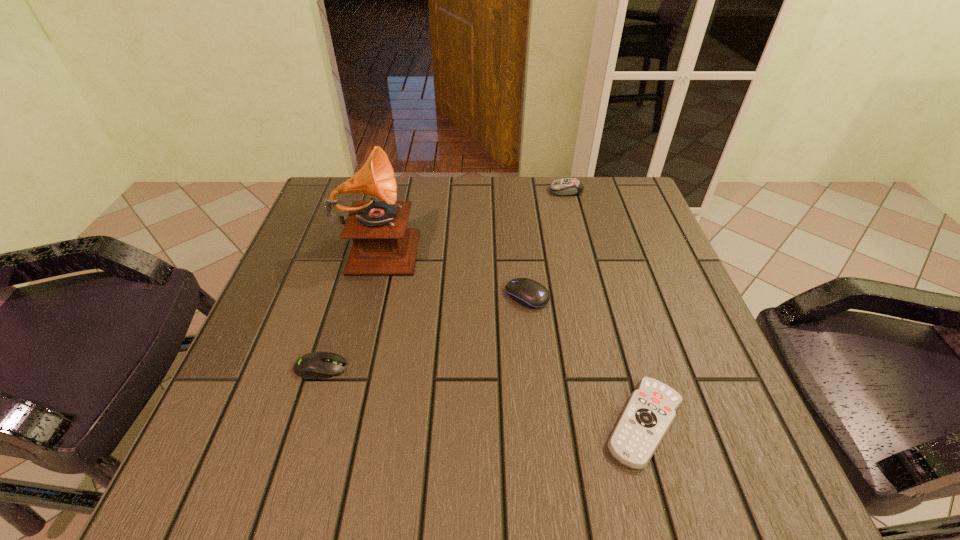
Locate an element on the screen. The width and height of the screenshot is (960, 540). free spot between the phonograph record and the nearest object is located at coordinates (512, 334).

The height and width of the screenshot is (540, 960). What are the coordinates of `vacant region between the farthest object and the second shortest object` in the screenshot? It's located at (x=444, y=279).

Where is `free space between the shortest object and the second nearest object`? This screenshot has width=960, height=540. free space between the shortest object and the second nearest object is located at coordinates (483, 395).

Locate an element on the screen. The image size is (960, 540). free space that is in between the phonograph record and the second computer mouse from right to left is located at coordinates (453, 271).

Where is `the third closest object to the rightmost computer mouse`? Image resolution: width=960 pixels, height=540 pixels. the third closest object to the rightmost computer mouse is located at coordinates (650, 411).

Identify which object is located as the third nearest to the second farthest computer mouse. Please provide its 2D coordinates. Your answer should be formatted as a tuple, i.e. [(x, y)], where the tuple contains the x and y coordinates of a point satisfying the conditions above.

[(316, 365)]

Where is `computer mouse identified as the second closest to the rightmost computer mouse`? The image size is (960, 540). computer mouse identified as the second closest to the rightmost computer mouse is located at coordinates (316, 365).

Where is `computer mouse that is the third closest to the shortest object`? The height and width of the screenshot is (540, 960). computer mouse that is the third closest to the shortest object is located at coordinates (567, 186).

Identify the location of vacant region that satisfies the following two spatial constraints: 1. on the back side of the nearest object; 2. on the horn of the second farthest object. This screenshot has height=540, width=960. (593, 245).

Where is `blank space that satisfies the following two spatial constraints: 1. on the wheel side of the second shortest object; 2. on the back side of the nearest object`? blank space that satisfies the following two spatial constraints: 1. on the wheel side of the second shortest object; 2. on the back side of the nearest object is located at coordinates (304, 423).